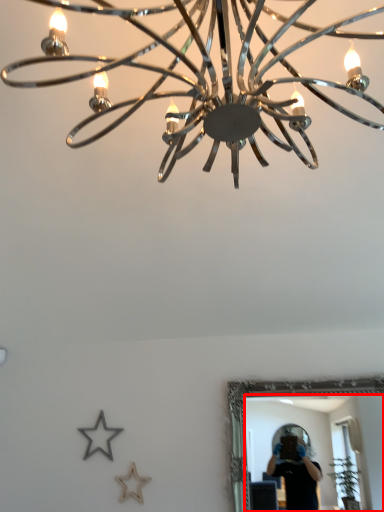
Question: From the image's perspective, what is the correct spatial relationship of mirror (annotated by the red box) in relation to lamp?

Choices:
 (A) above
 (B) below

Answer: (B)